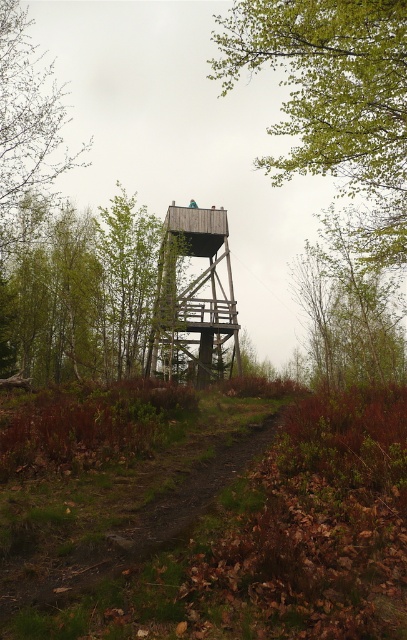
You are standing at the base of the wooden observation tower and want to take a photo of the green leafy tree at upper center. The camera you are using has a maximum focus range of 30 feet. Will you be able to capture the tree in focus without moving closer?

The green leafy tree at upper center is 30.72 feet away from the camera. Since the camera can only focus up to 30 feet, it cannot capture the tree in focus without moving closer.

You are standing at the base of the wooden observation tower and want to find the brown dirt path at center. According to the map coordinates, where should you look to find it?

The brown dirt path at center is located at the 2D coordinates point (x=118, y=509), so you should look in that direction to find it.

You are hiking along the brown dirt path at center and want to reach the green leafy tree at upper center. Which direction should you move to get closer to the tree?

The green leafy tree at upper center is further to the viewer than the brown dirt path at center, so you should move forward along the path to get closer to the tree.